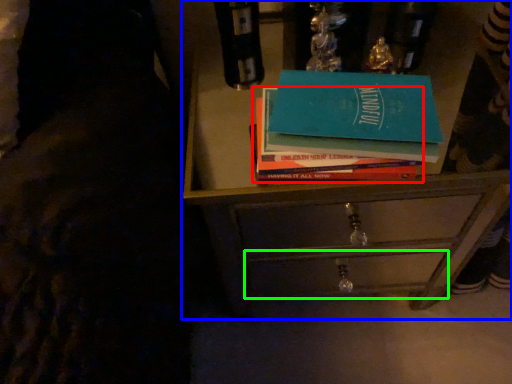
Question: Which object is positioned closest to book (highlighted by a red box)? Select from chest of drawers (highlighted by a blue box) and drawer (highlighted by a green box).

Choices:
 (A) chest of drawers
 (B) drawer

Answer: (A)